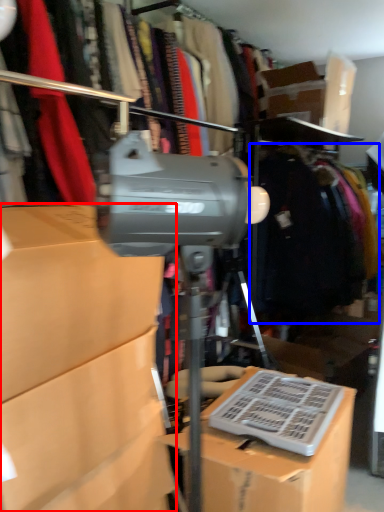
Question: Which point is closer to the camera, box (highlighted by a red box) or clothing (highlighted by a blue box)?

Choices:
 (A) box
 (B) clothing

Answer: (A)